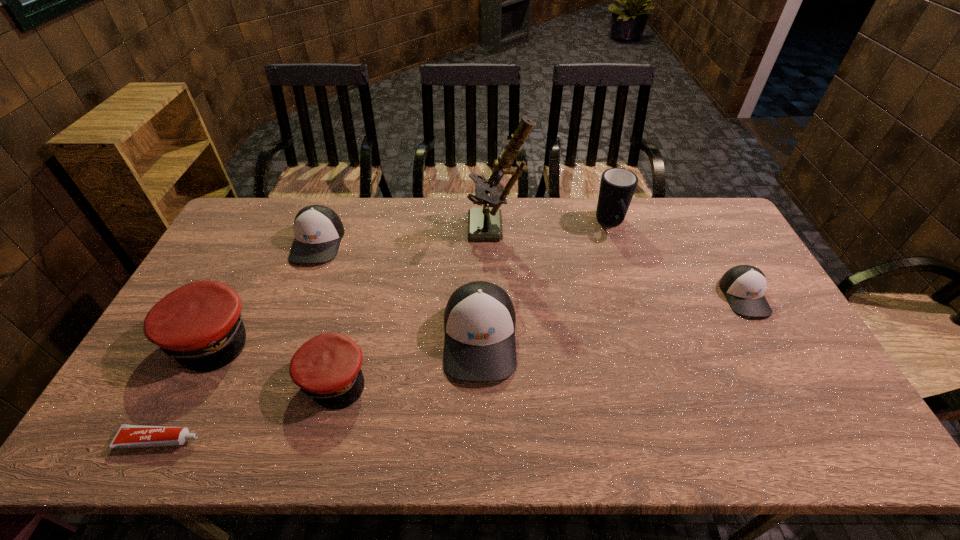
Identify the location of cap that is positioned at the left edge. (x=199, y=325).

Locate an element on the screen. Image resolution: width=960 pixels, height=540 pixels. toothpaste that is positioned at the left edge is located at coordinates (127, 436).

I want to click on object that is at the right edge, so click(x=744, y=286).

Locate an element on the screen. The height and width of the screenshot is (540, 960). object positioned at the near left corner is located at coordinates (127, 436).

This screenshot has width=960, height=540. Find the location of `vacant space at the far edge`. vacant space at the far edge is located at coordinates (647, 206).

In order to click on free space at the near edge of the desktop in this screenshot , I will do `click(365, 436)`.

This screenshot has width=960, height=540. In order to click on vacant space at the near right corner of the desktop in this screenshot , I will do `click(827, 446)`.

Where is `vacant space that's between the bigger red cap and the farthest cap`? vacant space that's between the bigger red cap and the farthest cap is located at coordinates (263, 289).

I want to click on empty space between the second object from right to left and the rightmost cap, so click(678, 260).

This screenshot has height=540, width=960. I want to click on free space between the seventh object from left to right and the third tallest object, so click(545, 280).